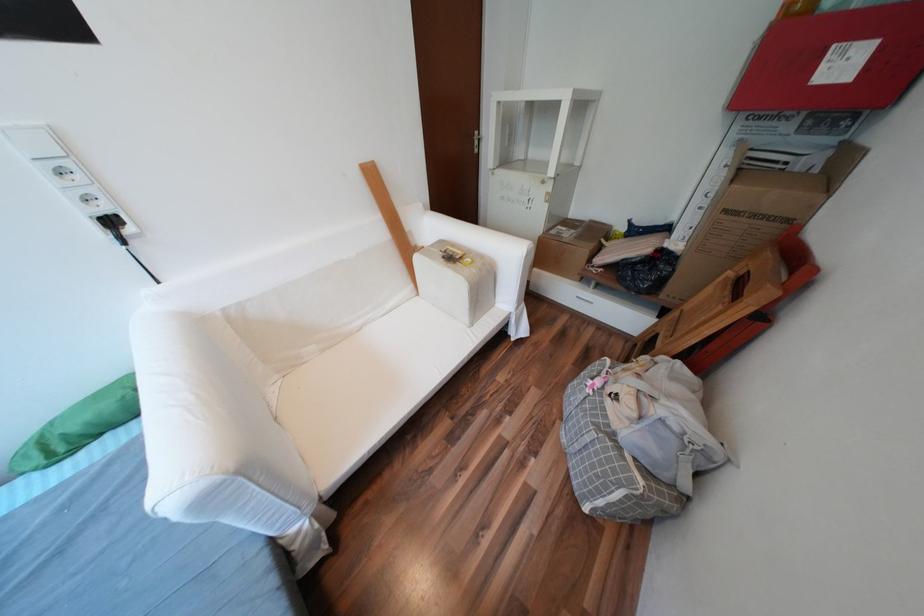
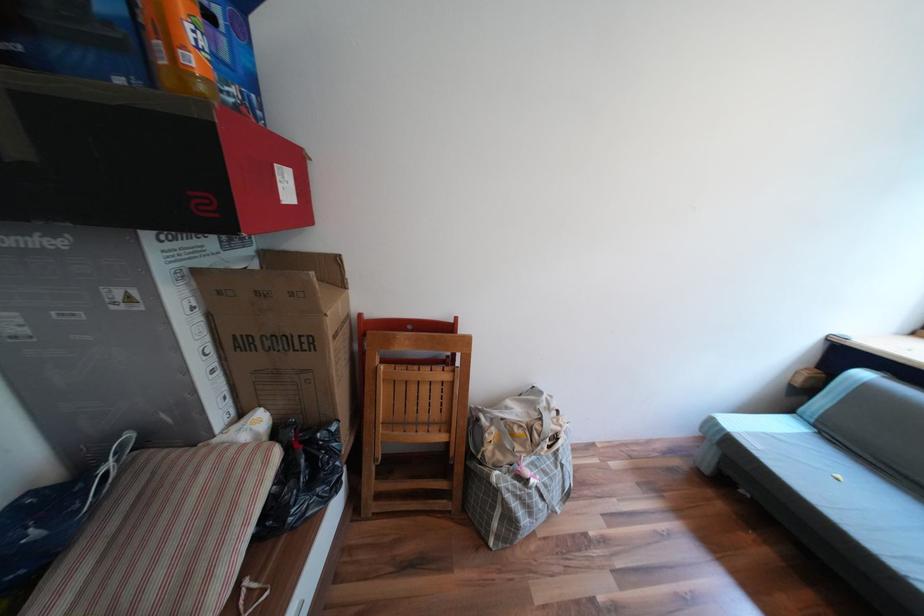
In the second image, find the point that corresponds to (x=832, y=67) in the first image.

(289, 185)